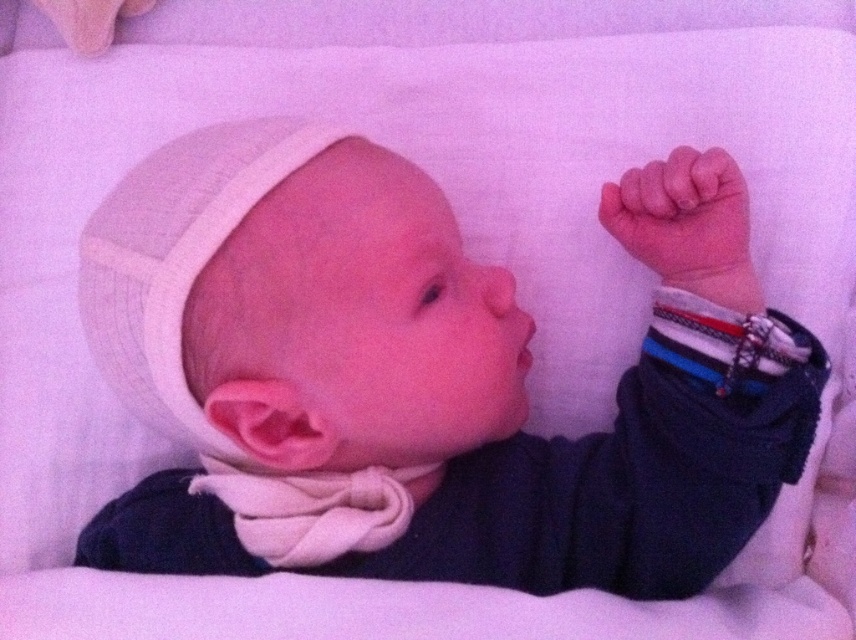
You are a parent holding a baby and want to place a rubber teething ring at upper right into the baby mouth. The white knit hat at upper left is currently on the baby. Should you remove the hat before placing the teething ring?

The white knit hat at upper left is positioned under the rubber teething ring at upper right, so the hat is already under the teething ring. Since the hat is on the baby and the teething ring is above it, you can place the teething ring without removing the hat.

You are a caregiver holding a baby in a soft white area. You notice the white knit hat at upper left and the rubber teething ring at upper right. Which object is positioned more to the left side of the scene?

The white knit hat at upper left is positioned more to the left side of the scene than the rubber teething ring at upper right.